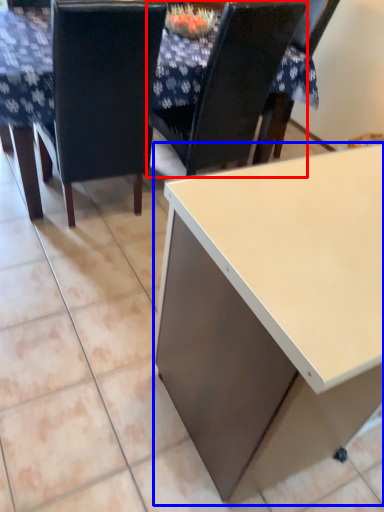
Question: Which object is closer to the camera taking this photo, chair (highlighted by a red box) or desk (highlighted by a blue box)?

Choices:
 (A) chair
 (B) desk

Answer: (B)